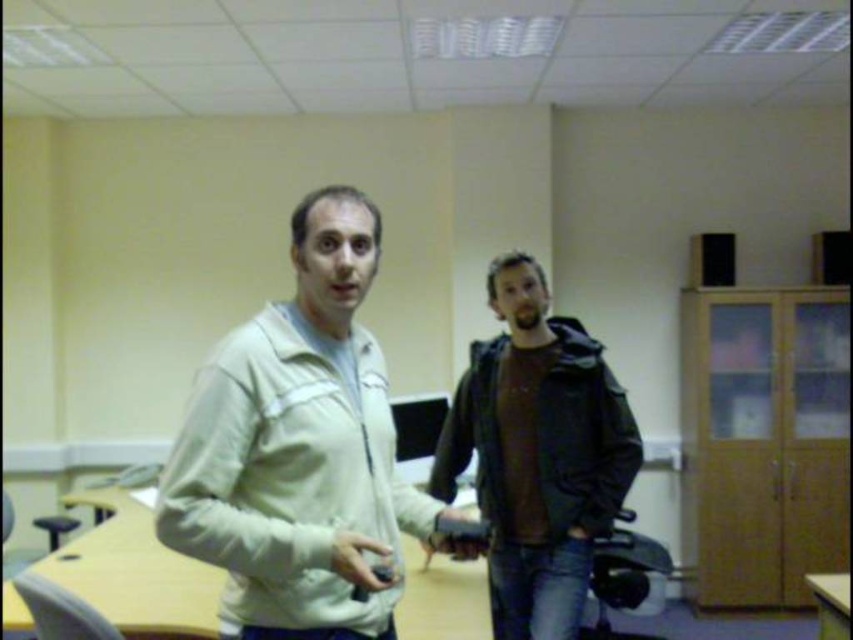
You are an observer in the room. You see the light beige jacket at center and the dark brown leather jacket at center. Which jacket is closer to the left wall?

The light beige jacket at center is positioned on the left side of dark brown leather jacket at center, so it is closer to the left wall.

You are designing a rack to hang both the light beige jacket at center and the dark brown leather jacket at center. Which jacket should you place on the higher hanger to accommodate their sizes?

The dark brown leather jacket at center is taller than the light beige jacket at center, so you should place the dark brown leather jacket at center on the higher hanger to accommodate its height.

You are standing in the office and need to determine which of the two points, point [219,483] or point [547,321], is nearer to you. Based on the scene, which point is closer?

Point [219,483] is closer to the viewer than point [547,321].